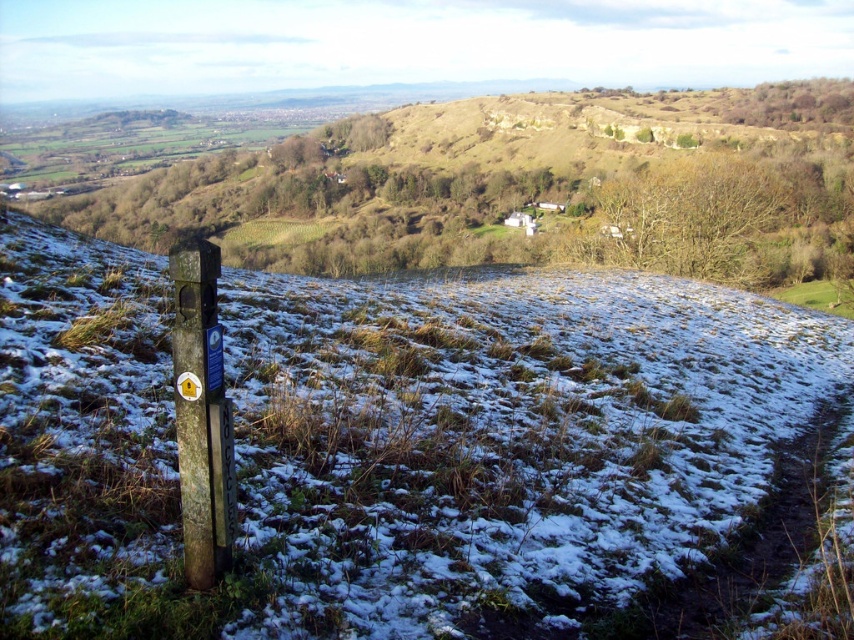
Question: Among these objects, which one is farthest from the camera?

Choices:
 (A) green grass at center
 (B) dark brown wooden post at lower left

Answer: (B)

Question: From the image, what is the correct spatial relationship of green grass at center in relation to dark brown wooden post at lower left?

Choices:
 (A) above
 (B) below

Answer: (A)

Question: Is green grass at center to the left of dark brown wooden post at lower left from the viewer's perspective?

Choices:
 (A) yes
 (B) no

Answer: (B)

Question: Can you confirm if green grass at center is smaller than dark brown wooden post at lower left?

Choices:
 (A) no
 (B) yes

Answer: (A)